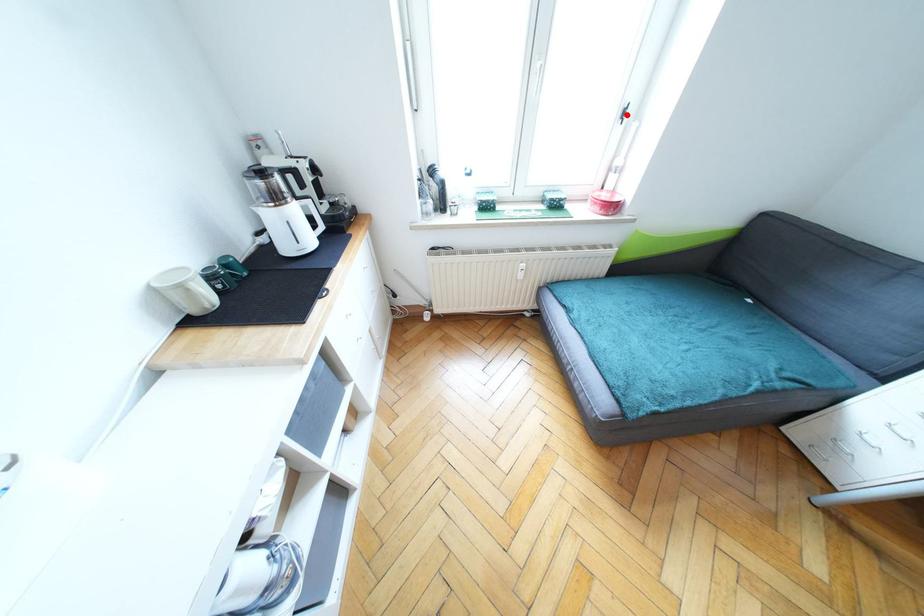
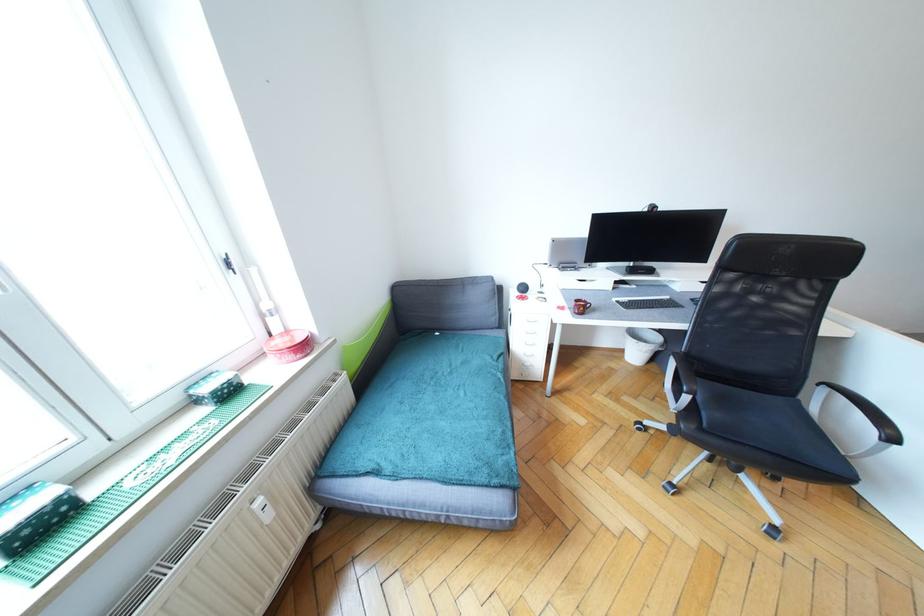
Locate, in the second image, the point that corresponds to the highlighted location in the first image.

(232, 265)